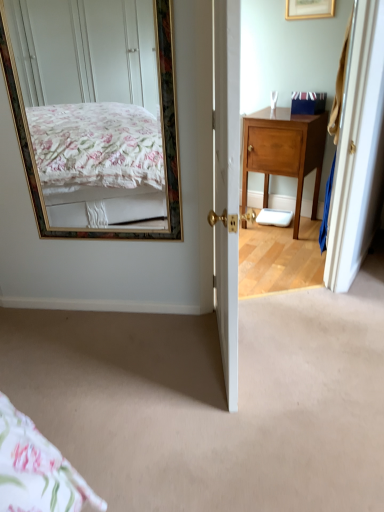
You are a GUI agent. You are given a task and a screenshot of the screen. Output one action in this format:
    pyautogui.click(x=<x>, y=<y>)
    Task: Click on the blue cardboard box at upper right
    This screenshot has width=384, height=512.
    Given the screenshot: What is the action you would take?
    pyautogui.click(x=308, y=103)

This screenshot has width=384, height=512. What do you see at coordinates (284, 152) in the screenshot?
I see `wooden cabinet at right` at bounding box center [284, 152].

What is the approximate height of carpet at center?

1.36 inches.

Where is `blue cardboard box at upper right`? The image size is (384, 512). blue cardboard box at upper right is located at coordinates (308, 103).

Does carpet at center contain wooden cabinet at right?

No, wooden cabinet at right is not surrounded by carpet at center.

Is point (217, 395) positioned behind point (250, 122)?

No, (217, 395) is in front of (250, 122).

You are a GUI agent. You are given a task and a screenshot of the screen. Output one action in this format:
    pyautogui.click(x=<x>, y=<y>)
    Task: Click on the desk behind the carpet at center
    This screenshot has height=512, width=384.
    Given the screenshot: What is the action you would take?
    point(284,152)

How different are the orientations of blue cardboard box at upper right and carpet at center in degrees?

blue cardboard box at upper right and carpet at center are facing 177 degrees away from each other.

Which of these two, blue cardboard box at upper right or carpet at center, stands taller?

blue cardboard box at upper right.

The width and height of the screenshot is (384, 512). In the image, there is a carpet at center. Find the location of `box above it (from the image's perspective)`. box above it (from the image's perspective) is located at coordinates (308, 103).

Looking at this image, considering the relative sizes of blue cardboard box at upper right and carpet at center in the image provided, is blue cardboard box at upper right bigger than carpet at center?

Actually, blue cardboard box at upper right might be smaller than carpet at center.

From a real-world perspective, who is located lower, wooden cabinet at right or blue cardboard box at upper right?

wooden cabinet at right, from a real-world perspective.

Which of these two, wooden cabinet at right or blue cardboard box at upper right, stands taller?

wooden cabinet at right is taller.

Considering the points (311, 154) and (325, 94), which point is in front, point (311, 154) or point (325, 94)?

The point (325, 94) is more forward.

Could you tell me if wooden cabinet at right is facing blue cardboard box at upper right?

No, wooden cabinet at right is not oriented towards blue cardboard box at upper right.

In terms of width, does blue cardboard box at upper right look wider or thinner when compared to wooden cabinet at right?

Clearly, blue cardboard box at upper right has less width compared to wooden cabinet at right.

Can we say blue cardboard box at upper right lies outside wooden cabinet at right?

Yes, blue cardboard box at upper right is located beyond the bounds of wooden cabinet at right.

Considering the relative sizes of blue cardboard box at upper right and wooden cabinet at right in the image provided, is blue cardboard box at upper right bigger than wooden cabinet at right?

No, blue cardboard box at upper right is not bigger than wooden cabinet at right.

Which is less distant, (x=302, y=163) or (x=130, y=389)?

Point (x=302, y=163).

Considering the sizes of objects wooden cabinet at right and carpet at center in the image provided, who is wider, wooden cabinet at right or carpet at center?

carpet at center is wider.

Is wooden cabinet at right surrounding carpet at center?

Definitely not — carpet at center is not inside wooden cabinet at right.

Which object is positioned more to the left, wooden cabinet at right or carpet at center?

carpet at center is more to the left.

Considering the sizes of objects gold-framed mirror at upper left and wooden cabinet at right in the image provided, who is thinner, gold-framed mirror at upper left or wooden cabinet at right?

With smaller width is gold-framed mirror at upper left.

Is gold-framed mirror at upper left oriented towards wooden cabinet at right?

No.

Visually, is gold-framed mirror at upper left positioned to the left or to the right of wooden cabinet at right?

In the image, gold-framed mirror at upper left appears on the left side of wooden cabinet at right.

Is the surface of blue cardboard box at upper right in direct contact with gold-framed mirror at upper left?

blue cardboard box at upper right and gold-framed mirror at upper left are clearly separated.

Can you tell me how much blue cardboard box at upper right and gold-framed mirror at upper left differ in facing direction?

26.6 degrees.

Considering the positions of objects blue cardboard box at upper right and gold-framed mirror at upper left in the image provided, who is more to the right, blue cardboard box at upper right or gold-framed mirror at upper left?

blue cardboard box at upper right.

What are the coordinates of `plain located underneath the wooden cabinet at right (from a real-world perspective)` in the screenshot? It's located at (212, 401).

The width and height of the screenshot is (384, 512). Identify the location of box behind the carpet at center. (308, 103).

Based on their spatial positions, is carpet at center or gold-framed mirror at upper left further from blue cardboard box at upper right?

The object further to blue cardboard box at upper right is carpet at center.

Which object lies nearer to the anchor point blue cardboard box at upper right, wooden cabinet at right or carpet at center?

The object closer to blue cardboard box at upper right is wooden cabinet at right.

Looking at the image, which one is located further to carpet at center, gold-framed mirror at upper left or blue cardboard box at upper right?

blue cardboard box at upper right is positioned further to the anchor carpet at center.

From the image, which object appears to be nearer to gold-framed mirror at upper left, wooden cabinet at right or carpet at center?

wooden cabinet at right is closer to gold-framed mirror at upper left.

Which object lies further to the anchor point gold-framed mirror at upper left, carpet at center or wooden cabinet at right?

The object further to gold-framed mirror at upper left is carpet at center.

Looking at the image, which one is located further to carpet at center, wooden cabinet at right or blue cardboard box at upper right?

blue cardboard box at upper right is further to carpet at center.

When comparing their distances from gold-framed mirror at upper left, does blue cardboard box at upper right or wooden cabinet at right seem closer?

wooden cabinet at right is positioned closer to the anchor gold-framed mirror at upper left.

When comparing their distances from wooden cabinet at right, does blue cardboard box at upper right or carpet at center seem further?

carpet at center is further to wooden cabinet at right.

In order to click on mirror positioned between carpet at center and wooden cabinet at right from near to far in this screenshot , I will do `click(95, 115)`.

Identify the location of desk between gold-framed mirror at upper left and blue cardboard box at upper right. This screenshot has width=384, height=512. (284, 152).

The height and width of the screenshot is (512, 384). What are the coordinates of `mirror between carpet at center and blue cardboard box at upper right in the front-back direction` in the screenshot? It's located at (95, 115).

The image size is (384, 512). Identify the location of desk between carpet at center and blue cardboard box at upper right in the front-back direction. (284, 152).